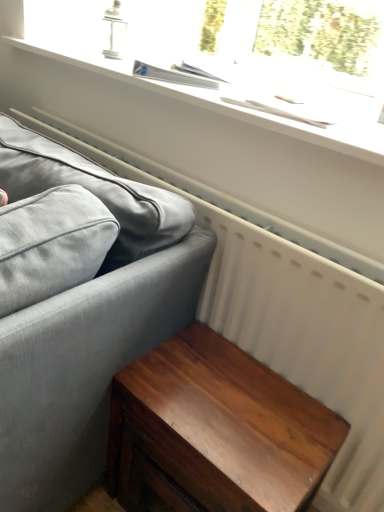
Question: Does shiny brown wood table at lower right have a lesser height compared to white matte window sill at upper center?

Choices:
 (A) no
 (B) yes

Answer: (A)

Question: Is shiny brown wood table at lower right at the left side of white matte window sill at upper center?

Choices:
 (A) yes
 (B) no

Answer: (B)

Question: Is white matte window sill at upper center a part of shiny brown wood table at lower right?

Choices:
 (A) yes
 (B) no

Answer: (B)

Question: Is shiny brown wood table at lower right not inside white matte window sill at upper center?

Choices:
 (A) no
 (B) yes

Answer: (B)

Question: Is shiny brown wood table at lower right taller than white matte window sill at upper center?

Choices:
 (A) yes
 (B) no

Answer: (A)

Question: Is shiny brown wood table at lower right bigger than white matte window sill at upper center?

Choices:
 (A) no
 (B) yes

Answer: (B)

Question: Considering the relative sizes of matte gray fabric couch at left and shiny brown wood table at lower right in the image provided, is matte gray fabric couch at left shorter than shiny brown wood table at lower right?

Choices:
 (A) no
 (B) yes

Answer: (A)

Question: Considering the relative sizes of matte gray fabric couch at left and shiny brown wood table at lower right in the image provided, is matte gray fabric couch at left bigger than shiny brown wood table at lower right?

Choices:
 (A) yes
 (B) no

Answer: (A)

Question: Can you confirm if matte gray fabric couch at left is taller than shiny brown wood table at lower right?

Choices:
 (A) yes
 (B) no

Answer: (A)

Question: Could shiny brown wood table at lower right be considered to be inside matte gray fabric couch at left?

Choices:
 (A) no
 (B) yes

Answer: (A)

Question: Considering the relative positions of matte gray fabric couch at left and shiny brown wood table at lower right in the image provided, is matte gray fabric couch at left to the left of shiny brown wood table at lower right from the viewer's perspective?

Choices:
 (A) no
 (B) yes

Answer: (B)

Question: Is matte gray fabric couch at left to the right of shiny brown wood table at lower right from the viewer's perspective?

Choices:
 (A) no
 (B) yes

Answer: (A)

Question: Can you confirm if white matte window sill at upper center is wider than shiny brown wood table at lower right?

Choices:
 (A) yes
 (B) no

Answer: (A)